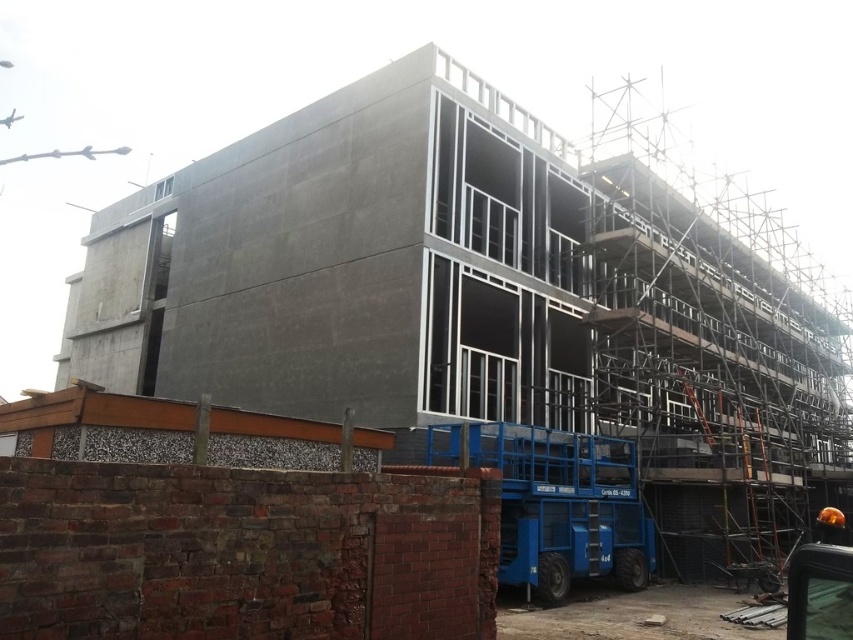
Consider the image. You are a construction worker standing at the base of the building. You need to move the shiny orange helmet at lower right to the metallic scaffolding at right. Which direction should you move it?

The metallic scaffolding at right is further away from you than the shiny orange helmet at lower right, so you should move the shiny orange helmet at lower right towards the direction of the metallic scaffolding at right.

You are a construction worker standing at the center of the construction site. You need to move to the nearest point on the metallic scaffolding at right. What is the direction you should walk towards?

The metallic scaffolding at right is located at point (711, 353). Since you are at the center, you should walk towards the right and slightly upwards to reach the nearest point on the metallic scaffolding at right.

You are a construction worker standing at the construction site. You need to move a heavy tool to the metallic scaffolding at right. If the tool weighs 100 kg and the path between you and the scaffolding is clear, can you safely carry it manually? Please consider the distance mentioned in the scene description.

The distance between you and the metallic scaffolding at right is 12.17 meters. However, the question of whether you can safely carry a 100 kg tool manually depends on factors like your physical capability and the path conditions, not just the distance. The scene description does not provide information about your physical strength or the path conditions, so it is not possible to determine safety based solely on the given data.